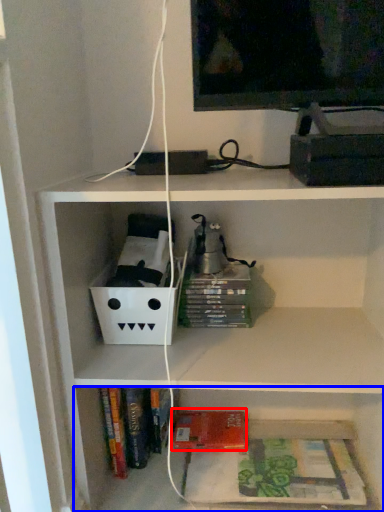
Question: Which point is closer to the camera, paperback book (highlighted by a red box) or shelf (highlighted by a blue box)?

Choices:
 (A) paperback book
 (B) shelf

Answer: (B)